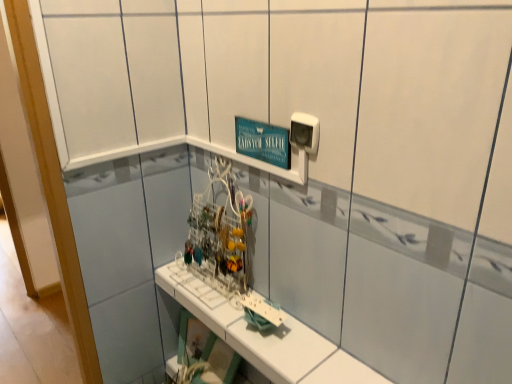
Question: Is white plastic electric outlet at upper right bigger or smaller than white plastic shelf at center?

Choices:
 (A) big
 (B) small

Answer: (B)

Question: Is white plastic electric outlet at upper right inside the boundaries of white plastic shelf at center, or outside?

Choices:
 (A) inside
 (B) outside

Answer: (B)

Question: Relative to white plastic shelf at center, is white plastic electric outlet at upper right in front or behind?

Choices:
 (A) front
 (B) behind

Answer: (B)

Question: Is white plastic shelf at center in front of or behind white plastic electric outlet at upper right in the image?

Choices:
 (A) front
 (B) behind

Answer: (A)

Question: From the image's perspective, relative to white plastic electric outlet at upper right, is white plastic shelf at center above or below?

Choices:
 (A) above
 (B) below

Answer: (B)

Question: Is point (317, 370) positioned closer to the camera than point (289, 137)?

Choices:
 (A) farther
 (B) closer

Answer: (A)

Question: In terms of height, does white plastic shelf at center look taller or shorter compared to white plastic electric outlet at upper right?

Choices:
 (A) short
 (B) tall

Answer: (A)